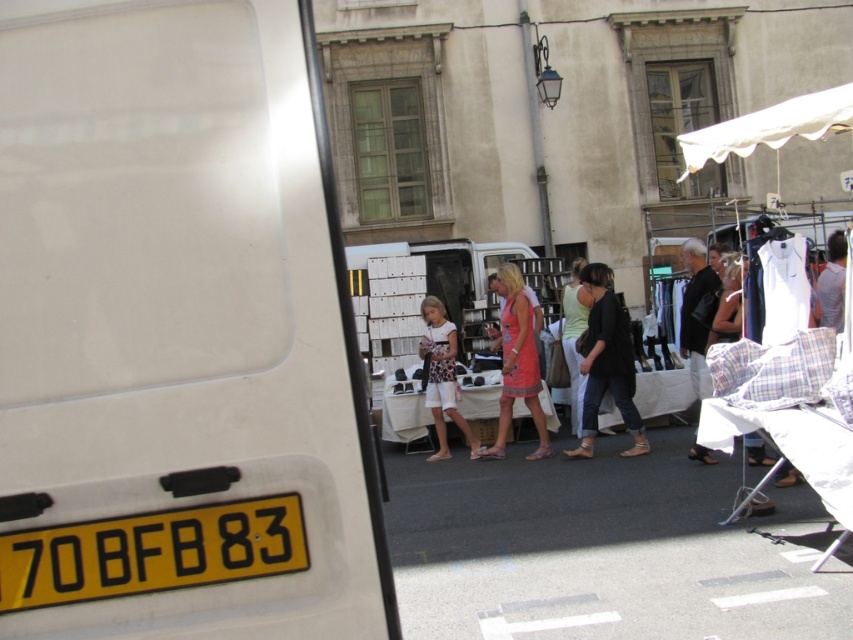
Question: Which object is closer to the camera taking this photo?

Choices:
 (A) dark gray fabric shirt at center
 (B) pink fabric dress at center
 (C) gray cotton shirt at right
 (D) yellow plastic license plate at lower left

Answer: (D)

Question: Is yellow plastic license plate at lower left thinner than pink fabric dress at center?

Choices:
 (A) yes
 (B) no

Answer: (A)

Question: Does pink fabric dress at center appear over dark gray fabric shirt at center?

Choices:
 (A) yes
 (B) no

Answer: (B)

Question: Can you confirm if white matte van at left is positioned below yellow plastic license plate at lower left?

Choices:
 (A) no
 (B) yes

Answer: (A)

Question: Which of the following is the closest to the observer?

Choices:
 (A) (630, 348)
 (B) (252, 128)

Answer: (B)

Question: Estimate the real-world distances between objects in this image. Which object is farther from the yellow plastic license plate at lower left?

Choices:
 (A) black leather jacket at center
 (B) gray cotton shirt at right
 (C) white matte van at left
 (D) dark gray fabric shirt at center

Answer: (D)